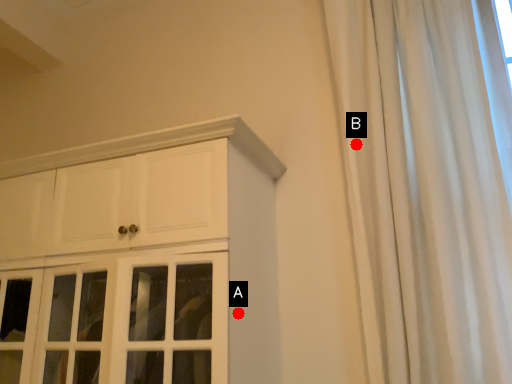
Question: Two points are circled on the image, labeled by A and B beside each circle. Which point appears closest to the camera in this image?

Choices:
 (A) A is closer
 (B) B is closer

Answer: (A)